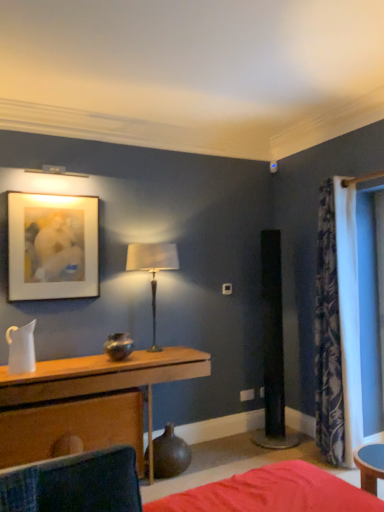
Question: Choose the correct answer: Is matte brown vase at lower center inside red fabric bed at lower center or outside it?

Choices:
 (A) outside
 (B) inside

Answer: (A)

Question: From a real-world perspective, relative to red fabric bed at lower center, is matte brown vase at lower center vertically above or below?

Choices:
 (A) above
 (B) below

Answer: (A)

Question: Which of these objects is positioned farthest from the wooden table at center?

Choices:
 (A) matte brown vase at lower center
 (B) metallic silver table lamp at center
 (C) red fabric bed at lower center
 (D) matte white picture frame at upper left
 (E) velvet red bed at lower center

Answer: (E)

Question: Which is farther from the floral fabric curtain at right?

Choices:
 (A) velvet dark green swivel chair at lower left
 (B) red fabric bed at lower center
 (C) velvet red bed at lower center
 (D) wooden table at center
 (E) matte white picture frame at upper left

Answer: (A)